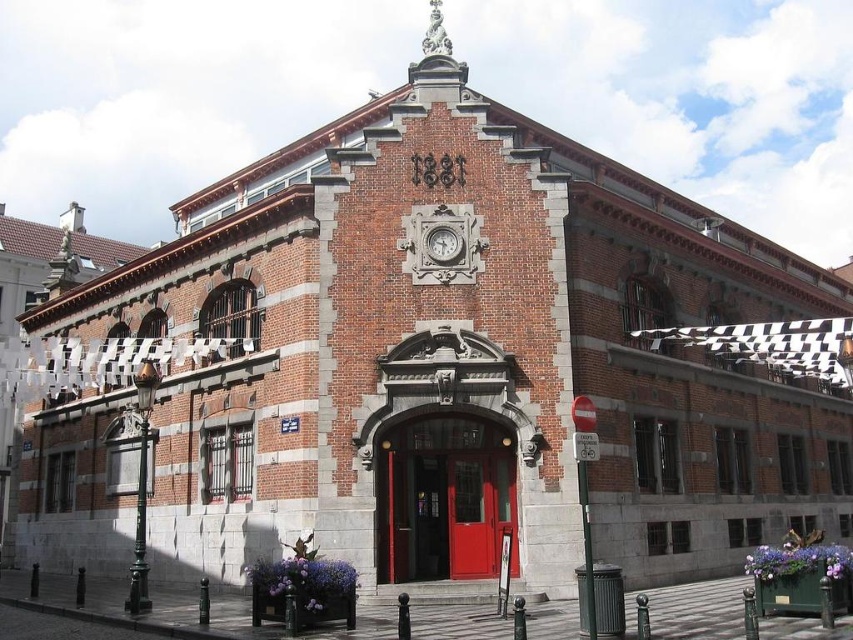
You are a painter hired to paint the front of the historic brick building. You need to determine which object, the smooth red door at center or the matte gray clock at center, requires more paint because it is taller. Which one do you choose?

The smooth red door at center is taller than the matte gray clock at center, so it requires more paint.

You are a delivery person trying to enter the building through the entrance. You notice the smooth red door at center and the matte gray clock at center. Which object should you interact with to enter the building?

The smooth red door at center is bigger than the matte gray clock at center, so you should interact with the smooth red door at center to enter the building.